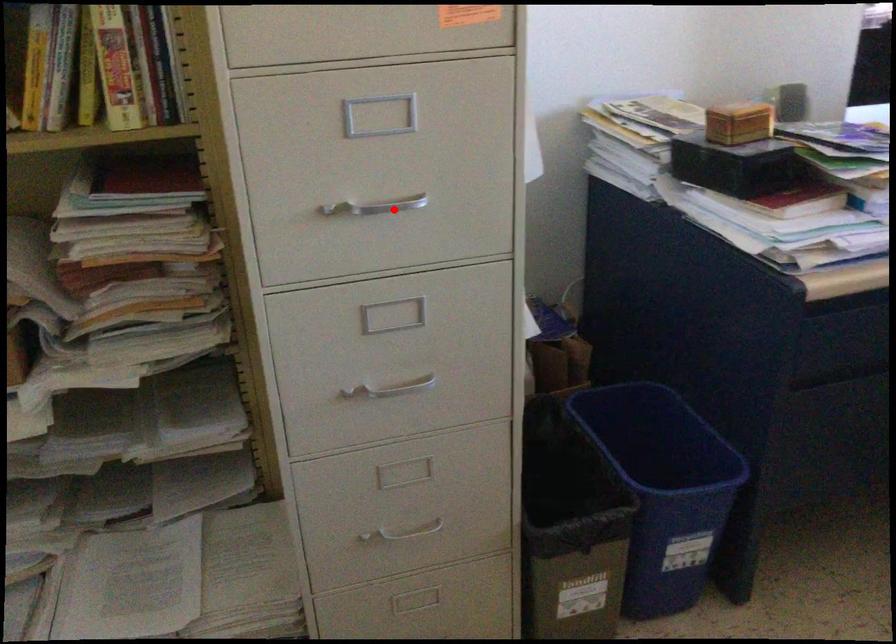
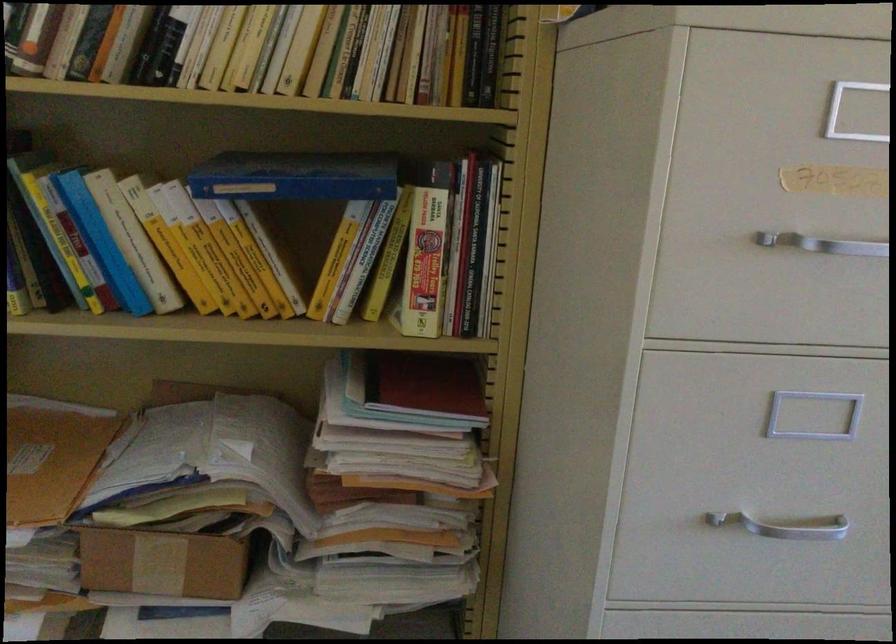
Question: I am providing you with two images of the same scene from different viewpoints. In image1, a red point is highlighted. Considering the same 3D point in image2, which of the following is correct?

Choices:
 (A) It is closer
 (B) It is farther

Answer: (A)